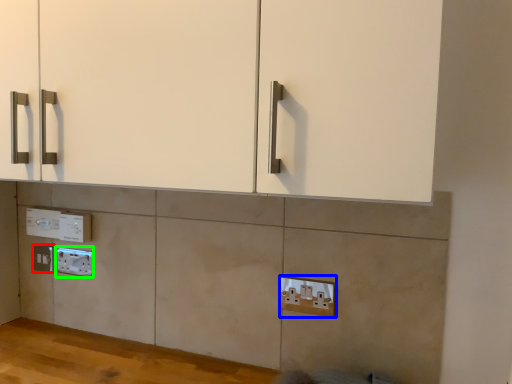
Question: Based on their relative distances, which object is farther from electric outlet (highlighted by a red box)? Choose from electric outlet (highlighted by a blue box) and electric outlet (highlighted by a green box).

Choices:
 (A) electric outlet
 (B) electric outlet

Answer: (A)